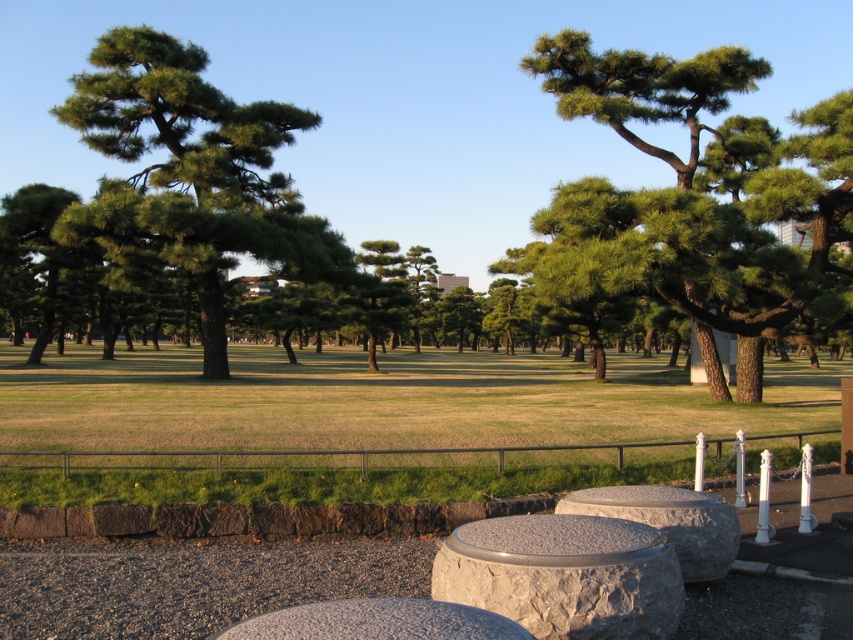
Between green textured tree at center and green matte tree at upper left, which one is positioned higher?

green textured tree at center is above.

Can you confirm if green textured tree at center is taller than green matte tree at upper left?

Correct, green textured tree at center is much taller as green matte tree at upper left.

Identify the location of green textured tree at center. Image resolution: width=853 pixels, height=640 pixels. (711, 189).

Where is `green textured tree at center`? The image size is (853, 640). green textured tree at center is located at coordinates (711, 189).

Between green textured tree at center and green matte tree at center, which one has more height?

Standing taller between the two is green matte tree at center.

Describe the element at coordinates (711, 189) in the screenshot. Image resolution: width=853 pixels, height=640 pixels. I see `green textured tree at center` at that location.

The height and width of the screenshot is (640, 853). What do you see at coordinates (711, 189) in the screenshot? I see `green textured tree at center` at bounding box center [711, 189].

This screenshot has height=640, width=853. Find the location of `green textured tree at center`. green textured tree at center is located at coordinates (711, 189).

Is green grass at lower center to the right of green matte tree at upper left from the viewer's perspective?

Indeed, green grass at lower center is positioned on the right side of green matte tree at upper left.

Is green grass at lower center above green matte tree at upper left?

Actually, green grass at lower center is below green matte tree at upper left.

Who is more distant from viewer, (7, 356) or (76, 195)?

Positioned behind is point (7, 356).

You are a GUI agent. You are given a task and a screenshot of the screen. Output one action in this format:
    pyautogui.click(x=<x>, y=<y>)
    Task: Click on the green grass at lower center
    The image size is (853, 640).
    Given the screenshot: What is the action you would take?
    pyautogui.click(x=381, y=401)